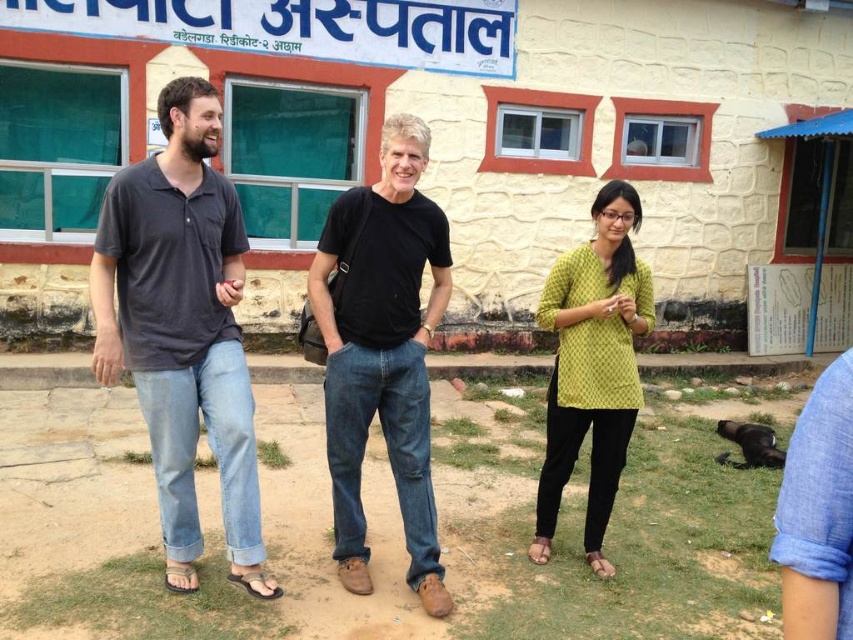
Based on the scene description, which person is taller between the dark gray cotton shirt at left and the yellow printed top at center?

The dark gray cotton shirt at left is taller than the yellow printed top at center.